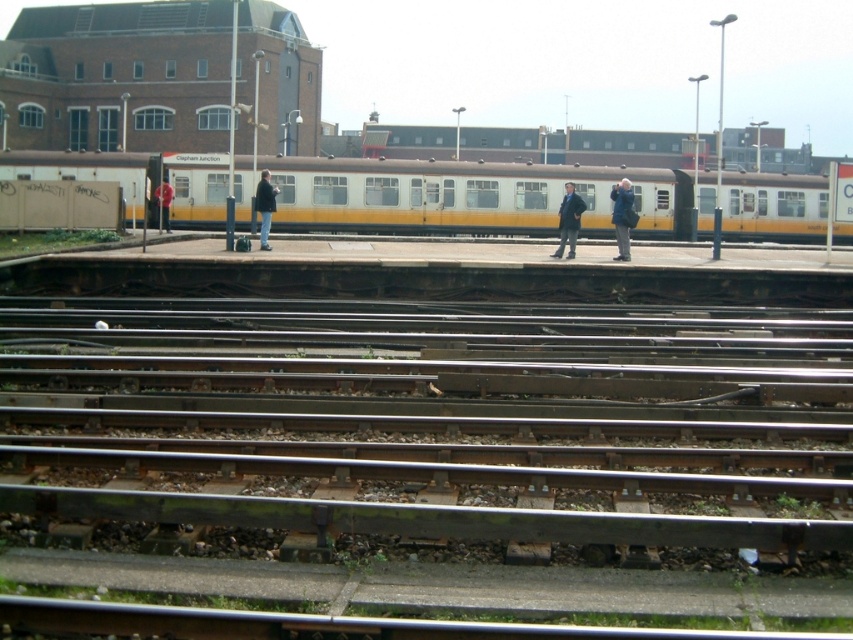
Does blue denim jacket at center have a larger size compared to dark gray jacket at center?

Indeed, blue denim jacket at center has a larger size compared to dark gray jacket at center.

Does blue denim jacket at center come in front of dark gray jacket at center?

Yes, blue denim jacket at center is in front of dark gray jacket at center.

Is point (621, 240) positioned in front of point (265, 212)?

Yes, it is.

Where is `blue denim jacket at center`? blue denim jacket at center is located at coordinates (622, 216).

Can you confirm if white/yellow painted passenger train at center is positioned to the right of blue denim jacket at center?

Incorrect, white/yellow painted passenger train at center is not on the right side of blue denim jacket at center.

Who is positioned more to the right, white/yellow painted passenger train at center or blue denim jacket at center?

blue denim jacket at center is more to the right.

Find the location of a particular element. This screenshot has height=640, width=853. white/yellow painted passenger train at center is located at coordinates (465, 196).

Is white/yellow painted passenger train at center to the right of dark blue jacket at center from the viewer's perspective?

Incorrect, white/yellow painted passenger train at center is not on the right side of dark blue jacket at center.

You are a GUI agent. You are given a task and a screenshot of the screen. Output one action in this format:
    pyautogui.click(x=<x>, y=<y>)
    Task: Click on the white/yellow painted passenger train at center
    The width and height of the screenshot is (853, 640).
    Given the screenshot: What is the action you would take?
    pyautogui.click(x=465, y=196)

Locate an element on the screen. Image resolution: width=853 pixels, height=640 pixels. white/yellow painted passenger train at center is located at coordinates (465, 196).